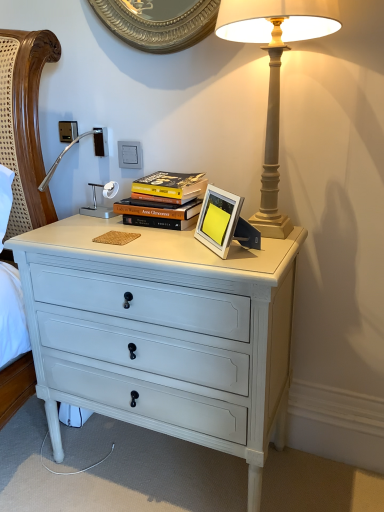
You are a GUI agent. You are given a task and a screenshot of the screen. Output one action in this format:
    pyautogui.click(x=<x>, y=<y>)
    Task: Click on the vacant space in front of silver metallic picture frame at center
    This screenshot has height=512, width=384.
    Given the screenshot: What is the action you would take?
    pyautogui.click(x=229, y=258)